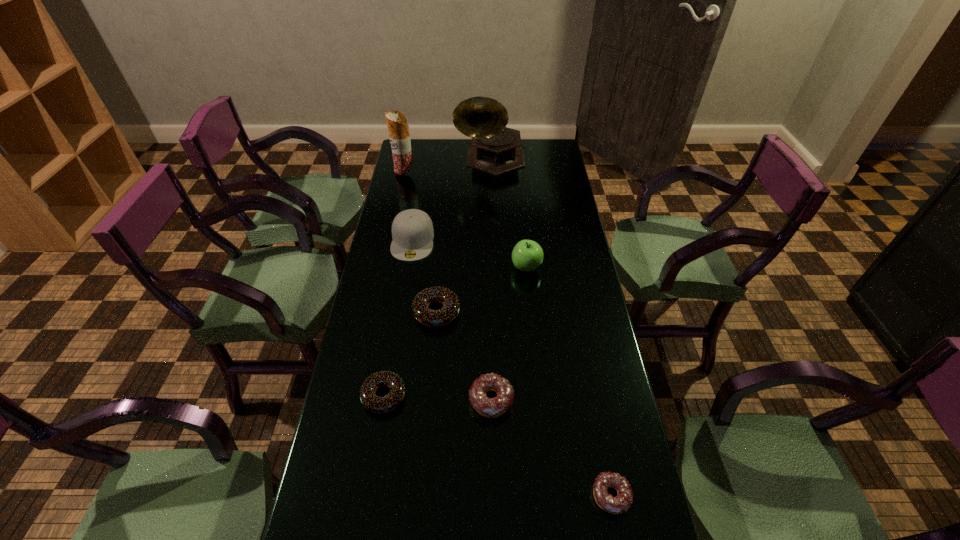
This screenshot has height=540, width=960. Identify the location of phonograph record. coord(495,149).

I want to click on burrito, so click(x=399, y=136).

Identify the location of apple. tap(527, 255).

Locate an element on the screen. green apple is located at coordinates (527, 255).

I want to click on the fourth tallest object, so click(412, 230).

You are a GUI agent. You are given a task and a screenshot of the screen. Output one action in this format:
    pyautogui.click(x=<x>, y=<y>)
    Task: Click on the cap
    Image resolution: width=960 pixels, height=540 pixels.
    Given the screenshot: What is the action you would take?
    pyautogui.click(x=412, y=230)

I want to click on the farther pink doughnut, so coord(488,407).

Where is `the second doughnut from right to left`? the second doughnut from right to left is located at coordinates (488, 407).

Where is `the bigger chocolate doughnut`? the bigger chocolate doughnut is located at coordinates (432, 318).

In order to click on the farthest doughnut in this screenshot , I will do `click(432, 318)`.